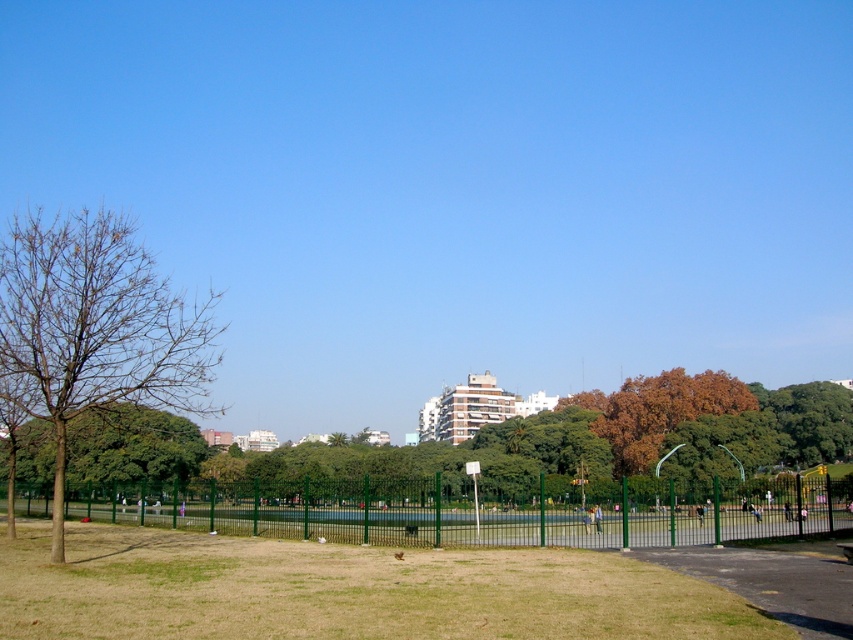
Question: Can you confirm if brown leafy tree at center is positioned below bare wood tree at left?

Choices:
 (A) yes
 (B) no

Answer: (A)

Question: Can you confirm if green grassy field at lower center is thinner than green metal fence at center?

Choices:
 (A) no
 (B) yes

Answer: (B)

Question: Among these objects, which one is farthest from the camera?

Choices:
 (A) bare wood tree at left
 (B) brown leafy tree at center
 (C) green metal fence at center
 (D) green grassy field at lower center

Answer: (C)

Question: Does green grassy field at lower center have a smaller size compared to brown leafy tree at center?

Choices:
 (A) yes
 (B) no

Answer: (A)

Question: Which object appears farthest from the camera in this image?

Choices:
 (A) bare wood tree at left
 (B) brown leafy tree at center
 (C) green metal fence at center

Answer: (C)

Question: Which of the following is the farthest from the observer?

Choices:
 (A) green grassy field at lower center
 (B) bare wood tree at left

Answer: (B)